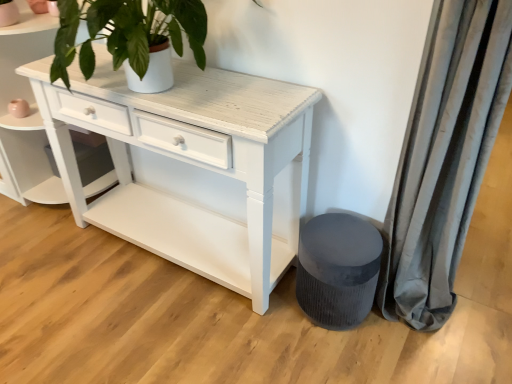
Question: Does white distressed wood shelf at center lie behind gray velvet curtain at right?

Choices:
 (A) no
 (B) yes

Answer: (B)

Question: Would you consider white distressed wood shelf at center to be distant from gray velvet curtain at right?

Choices:
 (A) yes
 (B) no

Answer: (A)

Question: Is white distressed wood shelf at center completely or partially outside of gray velvet curtain at right?

Choices:
 (A) yes
 (B) no

Answer: (A)

Question: Can you confirm if white distressed wood shelf at center is wider than gray velvet curtain at right?

Choices:
 (A) yes
 (B) no

Answer: (A)

Question: Is white distressed wood shelf at center facing towards gray velvet curtain at right?

Choices:
 (A) no
 (B) yes

Answer: (A)

Question: Is white distressed wood shelf at center taller or shorter than velvet grey stool at lower right?

Choices:
 (A) tall
 (B) short

Answer: (A)

Question: Considering their positions, is white distressed wood shelf at center located in front of or behind velvet grey stool at lower right?

Choices:
 (A) behind
 (B) front

Answer: (A)

Question: From the image's perspective, is white distressed wood shelf at center above or below velvet grey stool at lower right?

Choices:
 (A) below
 (B) above

Answer: (B)

Question: Does point (x=104, y=178) appear closer or farther from the camera than point (x=313, y=249)?

Choices:
 (A) farther
 (B) closer

Answer: (A)

Question: From the image's perspective, is velvet grey stool at lower right located above or below white distressed wood shelf at center?

Choices:
 (A) above
 (B) below

Answer: (B)

Question: Considering the positions of velvet grey stool at lower right and white distressed wood shelf at center in the image, is velvet grey stool at lower right bigger or smaller than white distressed wood shelf at center?

Choices:
 (A) big
 (B) small

Answer: (B)

Question: In the image, is velvet grey stool at lower right on the left side or the right side of white distressed wood shelf at center?

Choices:
 (A) left
 (B) right

Answer: (B)

Question: Looking at their shapes, would you say velvet grey stool at lower right is wider or thinner than white distressed wood shelf at center?

Choices:
 (A) wide
 (B) thin

Answer: (B)

Question: Is gray velvet curtain at right bigger or smaller than white distressed wood shelf at center?

Choices:
 (A) big
 (B) small

Answer: (B)

Question: From the image's perspective, is gray velvet curtain at right located above or below white distressed wood shelf at center?

Choices:
 (A) above
 (B) below

Answer: (B)